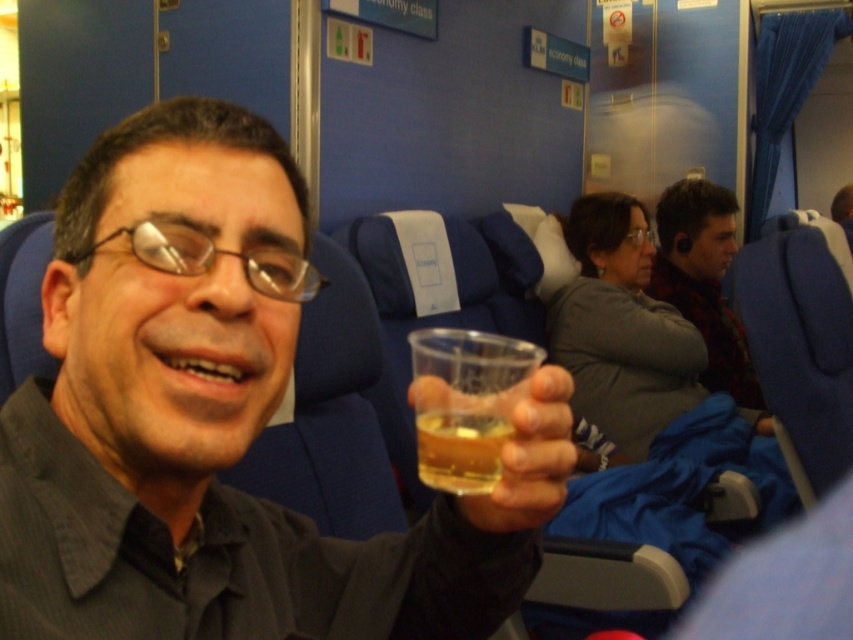
Question: From the image, what is the correct spatial relationship of flannel shirt at center in relation to translucent plastic cup at center?

Choices:
 (A) right
 (B) left

Answer: (A)

Question: Is clear plastic cup at center positioned behind flannel shirt at center?

Choices:
 (A) yes
 (B) no

Answer: (B)

Question: Which of the following is the closest to the observer?

Choices:
 (A) click(473, 488)
 (B) click(666, 212)

Answer: (A)

Question: Based on their relative distances, which object is nearer to the flannel shirt at center?

Choices:
 (A) clear plastic cup at center
 (B) translucent plastic cup at center

Answer: (A)

Question: Which point is farther to the camera?

Choices:
 (A) translucent plastic cup at center
 (B) clear plastic cup at center
 (C) flannel shirt at center

Answer: (C)

Question: Does flannel shirt at center appear over translucent plastic cup at center?

Choices:
 (A) no
 (B) yes

Answer: (B)